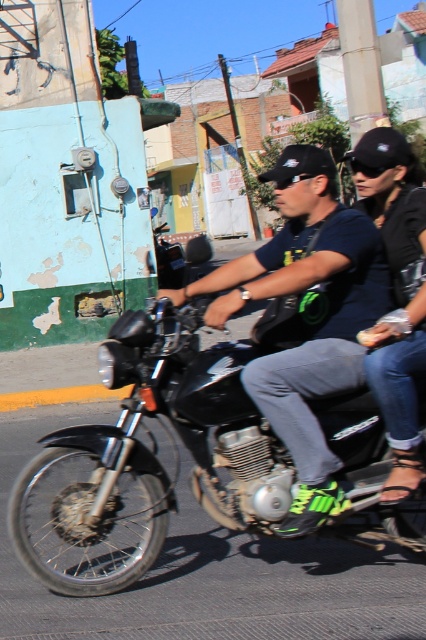
Question: Can you confirm if black matte motorcycle at center is positioned to the right of matte black motorcycle at center?

Choices:
 (A) no
 (B) yes

Answer: (A)

Question: Considering the relative positions of black matte motorcycle at center and matte black motorcycle at center in the image provided, where is black matte motorcycle at center located with respect to matte black motorcycle at center?

Choices:
 (A) above
 (B) below

Answer: (B)

Question: Which of the following is the farthest from the observer?

Choices:
 (A) (198, 381)
 (B) (233, 273)

Answer: (B)

Question: Which object appears farthest from the camera in this image?

Choices:
 (A) black matte motorcycle at center
 (B) matte black motorcycle at center

Answer: (A)

Question: Among these points, which one is farthest from the camera?

Choices:
 (A) (275, 275)
 (B) (249, 404)

Answer: (B)

Question: Does black matte motorcycle at center appear under matte black motorcycle at center?

Choices:
 (A) no
 (B) yes

Answer: (B)